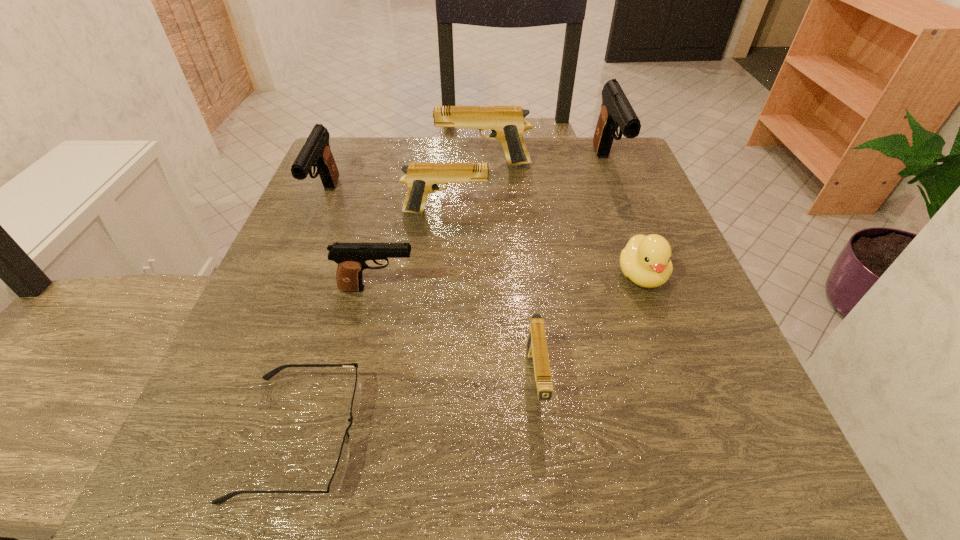
Identify the location of vacant space located 0.260m on the beak of the duckling. (705, 448).

The height and width of the screenshot is (540, 960). Find the location of `vacant region located at the barrel of the nearest pistol`. vacant region located at the barrel of the nearest pistol is located at coordinates (547, 496).

Find the location of a particular element. vacant space located 0.270m on the front-facing side of the shortest object is located at coordinates (563, 436).

Find the location of a particular element. object located in the near edge section of the desktop is located at coordinates (337, 478).

The image size is (960, 540). I want to click on spectacles situated at the left edge, so click(337, 478).

Locate an element on the screen. The height and width of the screenshot is (540, 960). pistol that is positioned at the right edge is located at coordinates (616, 112).

Find the location of `duckling that is at the right edge`. duckling that is at the right edge is located at coordinates (646, 260).

Where is `object that is at the far left corner`? Image resolution: width=960 pixels, height=540 pixels. object that is at the far left corner is located at coordinates coord(316,152).

Locate an element on the screen. This screenshot has height=540, width=960. object that is at the near left corner is located at coordinates (337, 478).

Where is `object that is at the far right corner`? This screenshot has width=960, height=540. object that is at the far right corner is located at coordinates (616, 112).